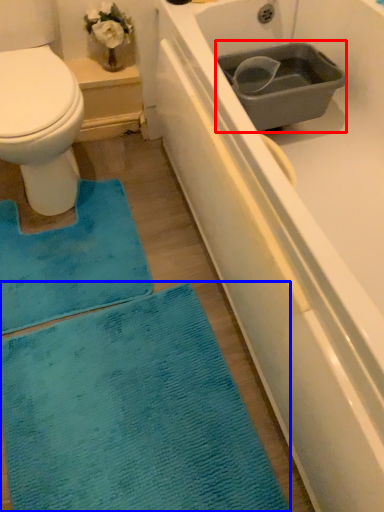
Question: Among these objects, which one is nearest to the camera, sink (highlighted by a red box) or bath mat (highlighted by a blue box)?

Choices:
 (A) sink
 (B) bath mat

Answer: (B)